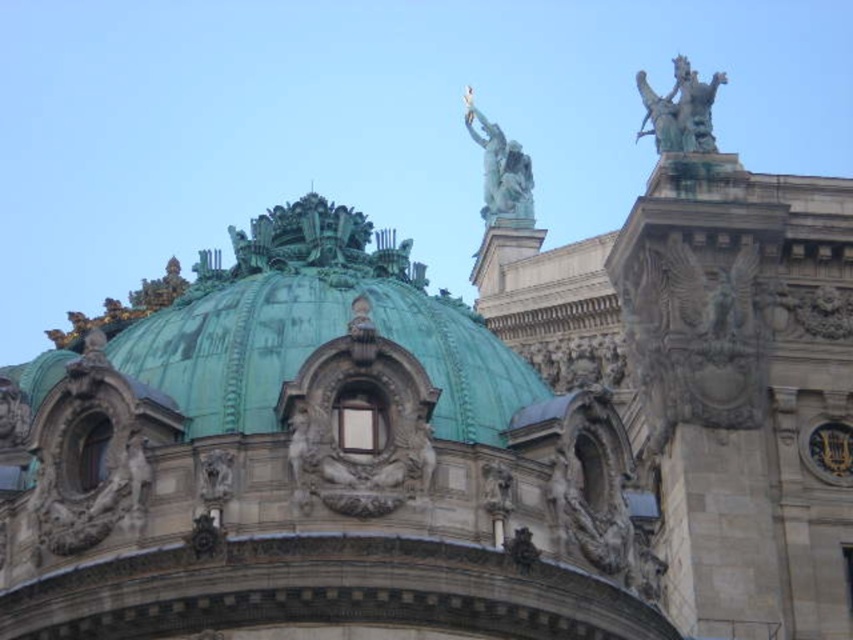
You are a drone operator tasked with capturing aerial footage of the dome and its surrounding statues. You need to fly your drone from the green patina statue at upper right to the green patina statue at upper center. Given that your drone has a maximum flight range of 100 feet, will it be able to make this journey without needing to recharge?

The distance between the green patina statue at upper right and the green patina statue at upper center is 98.21 feet. Since the drone can fly up to 100 feet, it will be able to complete the journey without needing to recharge.

You are an architect examining the building from the ground level. You notice the green patina dome at center and the green patina statue at upper right. Which object is closer to you from your vantage point?

The green patina dome at center is closer to you because it is in front of the green patina statue at upper right.